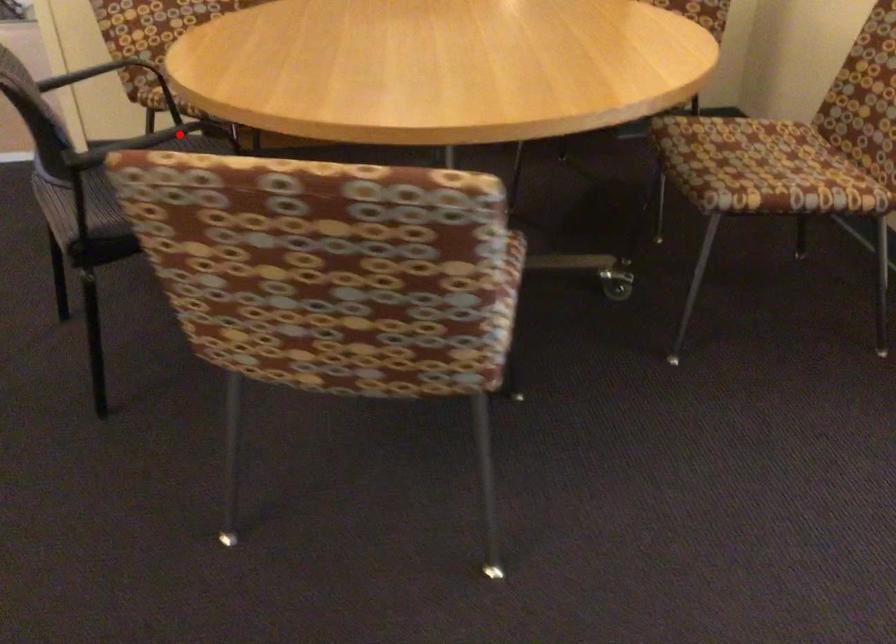
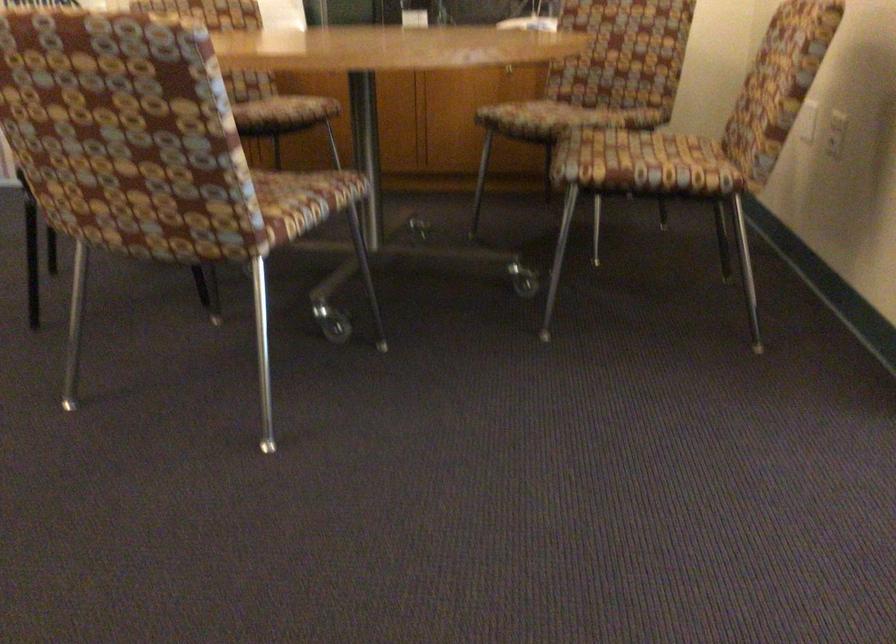
Question: I am providing you with two images of the same scene from different viewpoints. A red point is marked on the first image. Can you still see the location of the red point in image 2?

Choices:
 (A) Yes
 (B) No

Answer: (B)